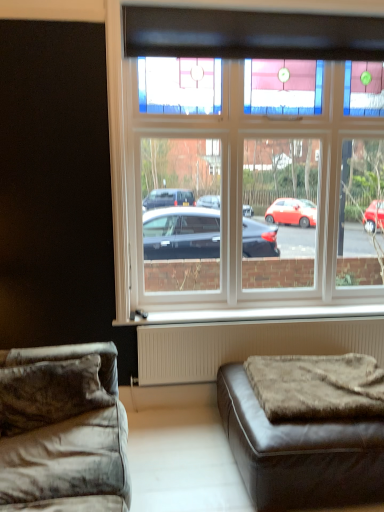
Identify the location of free point above brown fuzzy mattress at lower right (from a real-world perspective). The image size is (384, 512). (332, 367).